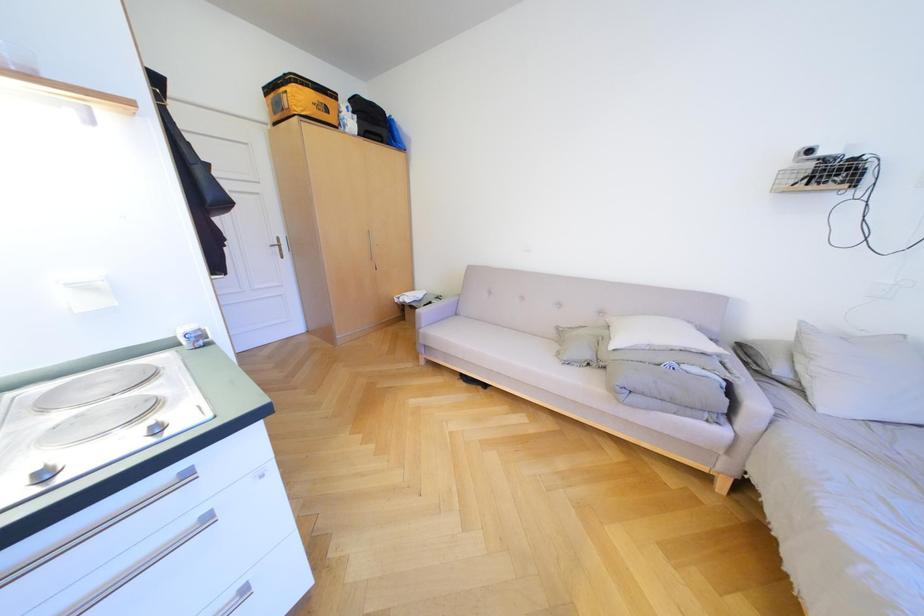
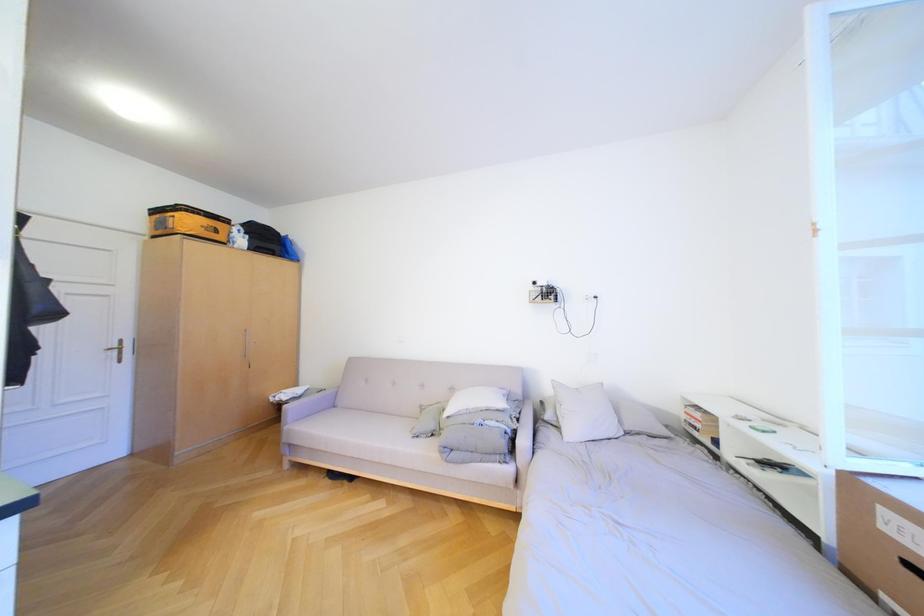
The images are taken continuously from a first-person perspective. In which direction is your viewpoint rotating?

The rotation direction of the camera is right-up.